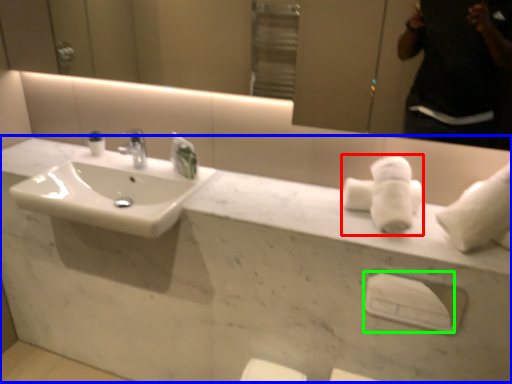
Question: Which is nearer to the bath towel (highlighted by a red box)? counter top (highlighted by a blue box) or towel bar (highlighted by a green box).

Choices:
 (A) counter top
 (B) towel bar

Answer: (B)